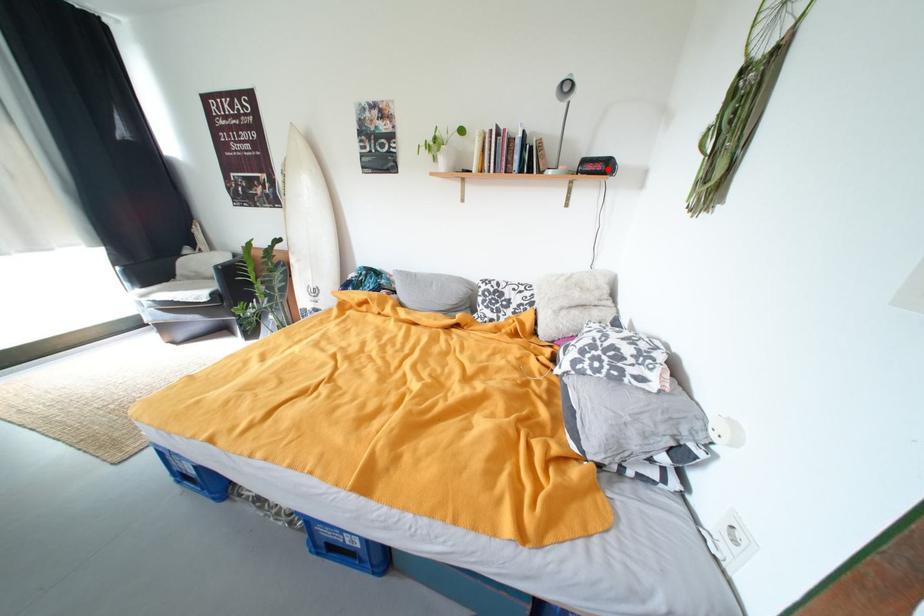
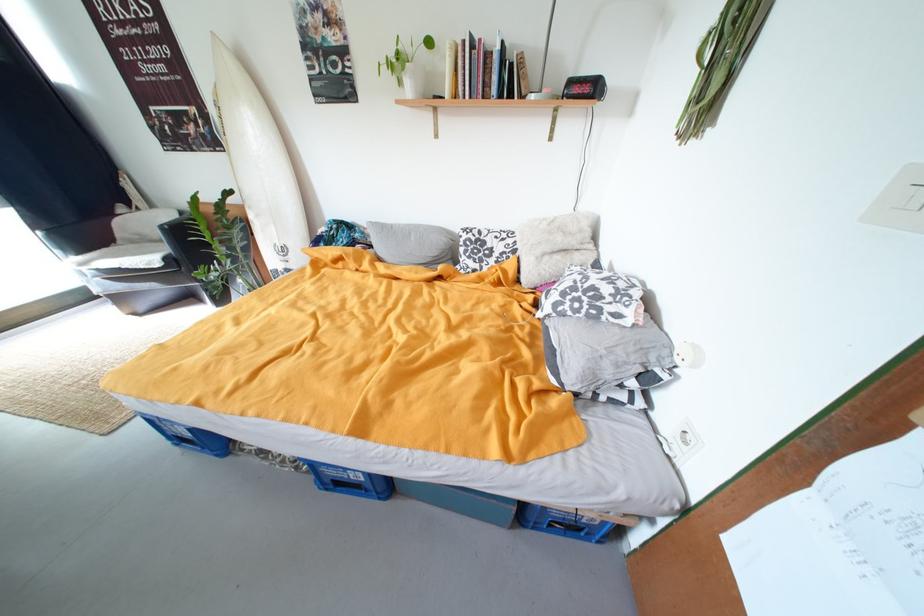
In the second image, find the point that corresponds to the highlighted location in the first image.

(594, 91)